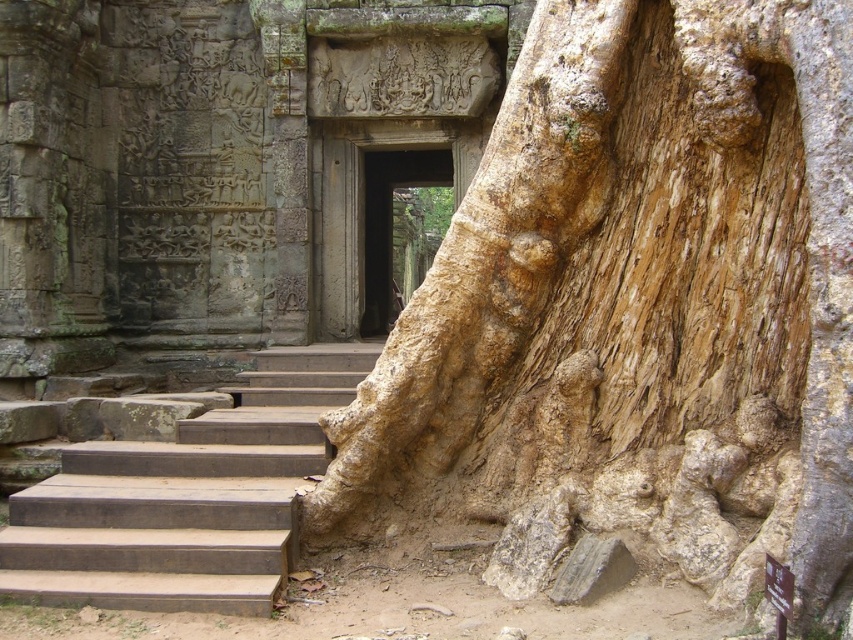
You are a visitor exploring the ancient stone structure and want to enter the brown stone door at center. However, you notice the brown wooden stairs at center in front of it. Can you walk through the space between them to reach the door?

The brown wooden stairs at center is not as tall as the brown stone door at center, so yes, you can walk through the space between them to reach the door.

Looking at this image, you are an archaeologist examining the ancient stone structure. You notice the light brown rough bark at center. Can you determine its exact location in the image using coordinates?

The light brown rough bark at center is located at coordinates point (592, 262).

You are an archaeologist examining the ancient stone structure. You notice a specific point marked at coordinates (592,262). What is the feature located at this point?

The point at coordinates (592,262) marks the light brown rough bark at center, which is part of the large tree trunk growing into the stone structure.